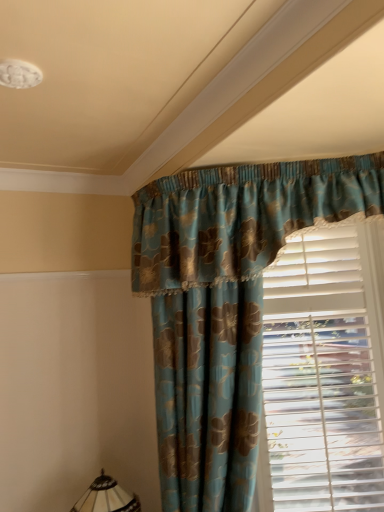
Question: Does white plastic blinds at right have a greater height compared to blue floral fabric curtain at center?

Choices:
 (A) yes
 (B) no

Answer: (B)

Question: Considering the relative positions of white plastic blinds at right and blue floral fabric curtain at center in the image provided, is white plastic blinds at right to the left of blue floral fabric curtain at center from the viewer's perspective?

Choices:
 (A) no
 (B) yes

Answer: (A)

Question: Is white plastic blinds at right aimed at blue floral fabric curtain at center?

Choices:
 (A) no
 (B) yes

Answer: (A)

Question: Considering the relative sizes of white plastic blinds at right and blue floral fabric curtain at center in the image provided, is white plastic blinds at right shorter than blue floral fabric curtain at center?

Choices:
 (A) no
 (B) yes

Answer: (B)

Question: Is white plastic blinds at right smaller than blue floral fabric curtain at center?

Choices:
 (A) no
 (B) yes

Answer: (B)

Question: Does white plastic blinds at right touch blue floral fabric curtain at center?

Choices:
 (A) no
 (B) yes

Answer: (A)

Question: Can you confirm if translucent glass lampshade at lower left is shorter than blue floral fabric curtain at center?

Choices:
 (A) no
 (B) yes

Answer: (B)

Question: Does translucent glass lampshade at lower left lie in front of blue floral fabric curtain at center?

Choices:
 (A) yes
 (B) no

Answer: (B)

Question: From the image's perspective, is translucent glass lampshade at lower left under blue floral fabric curtain at center?

Choices:
 (A) no
 (B) yes

Answer: (B)

Question: From a real-world perspective, is translucent glass lampshade at lower left over blue floral fabric curtain at center?

Choices:
 (A) yes
 (B) no

Answer: (B)

Question: Would you say translucent glass lampshade at lower left is a long distance from blue floral fabric curtain at center?

Choices:
 (A) no
 (B) yes

Answer: (A)

Question: Is translucent glass lampshade at lower left bigger than blue floral fabric curtain at center?

Choices:
 (A) yes
 (B) no

Answer: (B)

Question: Does blue floral fabric curtain at center have a greater width compared to translucent glass lampshade at lower left?

Choices:
 (A) yes
 (B) no

Answer: (A)